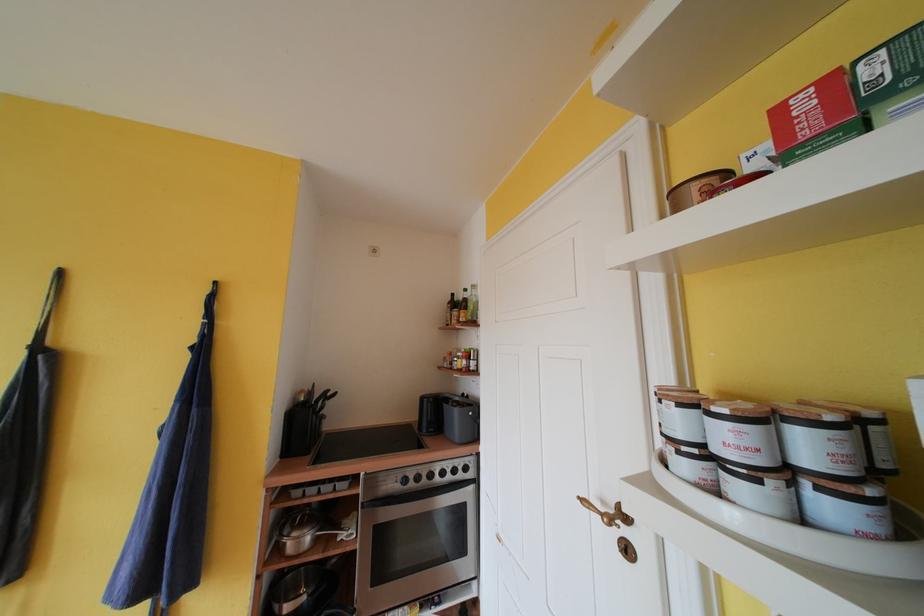
At what (x,y) coordinates should I click in order to perform the action: click on black electric kettle. Please return your answer as a coordinate pair (x, y). This screenshot has width=924, height=616. Looking at the image, I should click on (304, 589).